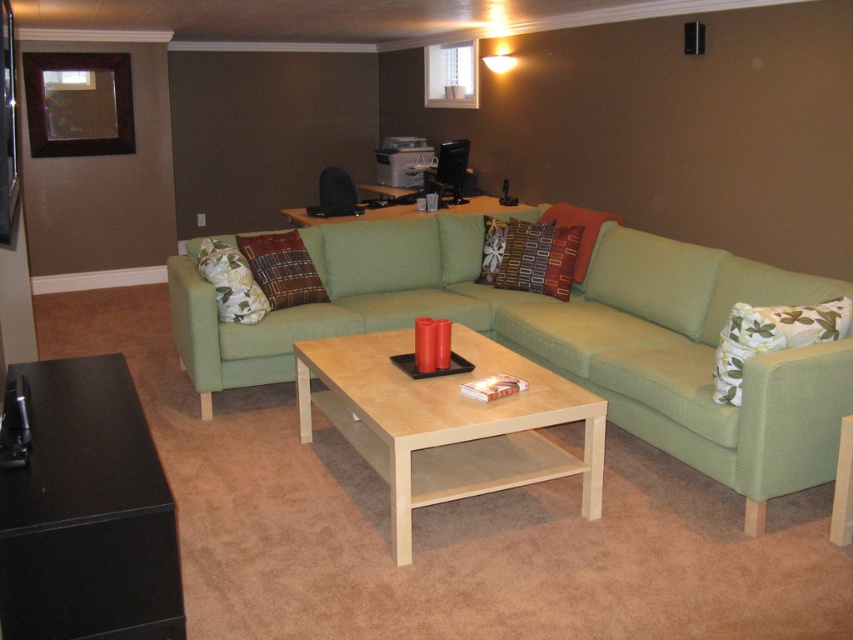
Does point (219, 252) come farther from viewer compared to point (392, 205)?

No, it is not.

Does point (254, 314) come behind point (527, 204)?

No, (254, 314) is closer to viewer.

I want to click on green floral pillow at left, so coord(230,282).

Is brown woven pillow at center below green floral pillow at left?

No, brown woven pillow at center is not below green floral pillow at left.

Is point (297, 259) farther from camera compared to point (215, 244)?

Yes, it is.

Locate an element on the screen. This screenshot has height=640, width=853. brown woven pillow at center is located at coordinates (282, 268).

Is point (424, 458) behind point (756, 349)?

Yes, it is behind point (756, 349).

Does point (500, 403) lie in front of point (733, 321)?

Yes.

The image size is (853, 640). In order to click on light wood/veneer coffee table at center in this screenshot , I will do `click(447, 422)`.